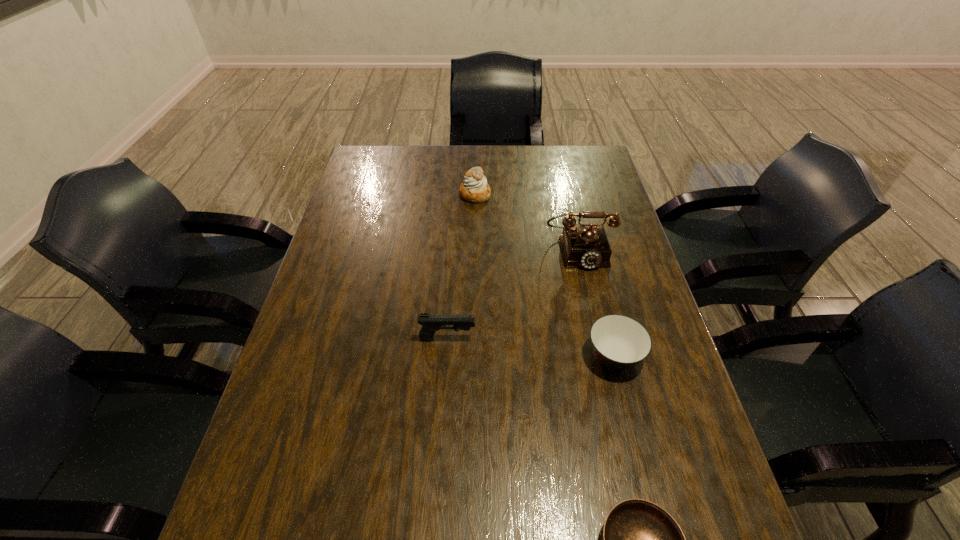
At what (x,y) coordinates should I click in order to perform the action: click on telephone located in the right edge section of the desktop. Please return your answer as a coordinate pair (x, y). Image resolution: width=960 pixels, height=540 pixels. Looking at the image, I should click on (586, 246).

I want to click on soup bowl situated at the right edge, so tap(619, 342).

In the image, there is a desktop. Identify the location of vacant area at the far edge. The width and height of the screenshot is (960, 540). (440, 167).

Identify the location of free space at the left edge. This screenshot has width=960, height=540. (386, 215).

The image size is (960, 540). I want to click on free location at the far left corner, so click(x=386, y=146).

I want to click on free point between the pastry and the telephone, so click(x=527, y=222).

Locate an element on the screen. Image resolution: width=960 pixels, height=540 pixels. free space between the pastry and the farther soup bowl is located at coordinates (544, 275).

Where is `free spot between the pastry and the farther soup bowl`? The height and width of the screenshot is (540, 960). free spot between the pastry and the farther soup bowl is located at coordinates (544, 275).

The width and height of the screenshot is (960, 540). I want to click on free spot between the taller soup bowl and the pastry, so click(x=544, y=275).

This screenshot has height=540, width=960. What are the coordinates of `free space between the second farthest object and the farthest object` in the screenshot? It's located at (527, 222).